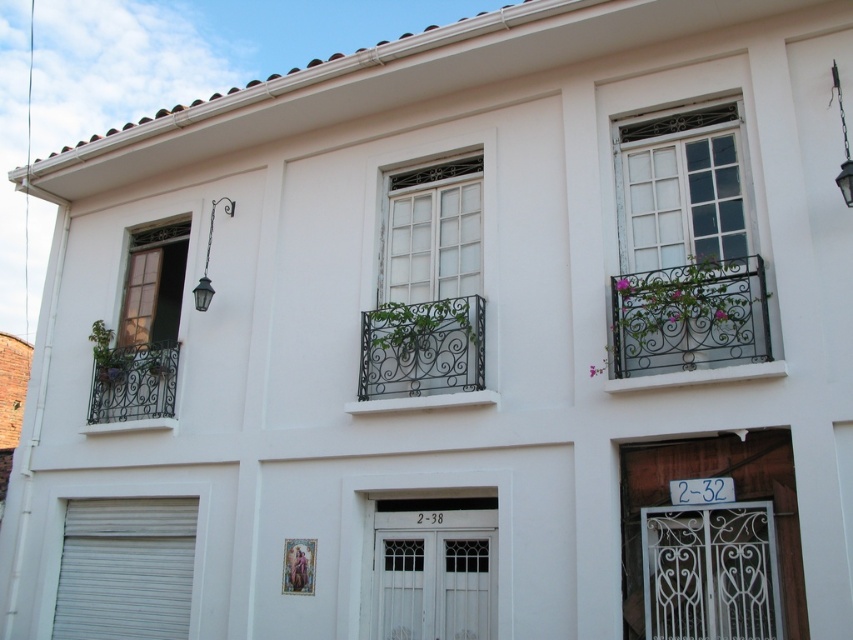
Measure the distance from black wrought iron balcony at center to wrought iron balcony at left.

black wrought iron balcony at center is 9.59 feet away from wrought iron balcony at left.

Is black wrought iron balcony at center positioned behind wrought iron balcony at left?

No.

Find the location of a particular element. Image resolution: width=853 pixels, height=640 pixels. black wrought iron balcony at center is located at coordinates (421, 355).

This screenshot has width=853, height=640. In order to click on black wrought iron balcony at center in this screenshot , I will do `click(421, 355)`.

Is wrought iron balcony at upper right to the left of black wrought iron balcony at center from the viewer's perspective?

Incorrect, wrought iron balcony at upper right is not on the left side of black wrought iron balcony at center.

In the scene shown: Does wrought iron balcony at upper right appear over black wrought iron balcony at center?

Correct, wrought iron balcony at upper right is located above black wrought iron balcony at center.

Between point (608, 388) and point (387, 406), which one is positioned in front?

Positioned in front is point (608, 388).

At what (x,y) coordinates should I click in order to perform the action: click on wrought iron balcony at upper right. Please return your answer as a coordinate pair (x, y). This screenshot has height=640, width=853. Looking at the image, I should click on (688, 321).

Does white painted wood window at upper right appear under black wrought iron balcony at center?

No.

Is white painted wood window at upper right further to camera compared to black wrought iron balcony at center?

No, white painted wood window at upper right is closer to the viewer.

Which is in front, point (662, 128) or point (415, 310)?

Point (662, 128) is in front.

Locate an element on the screen. white painted wood window at upper right is located at coordinates (679, 189).